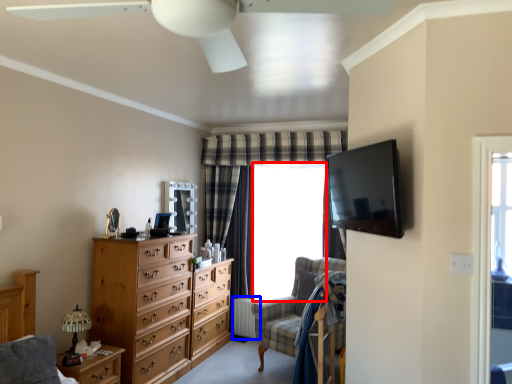
Question: Which object appears closest to the camera in this image, window screen (highlighted by a red box) or radiator (highlighted by a blue box)?

Choices:
 (A) window screen
 (B) radiator

Answer: (A)